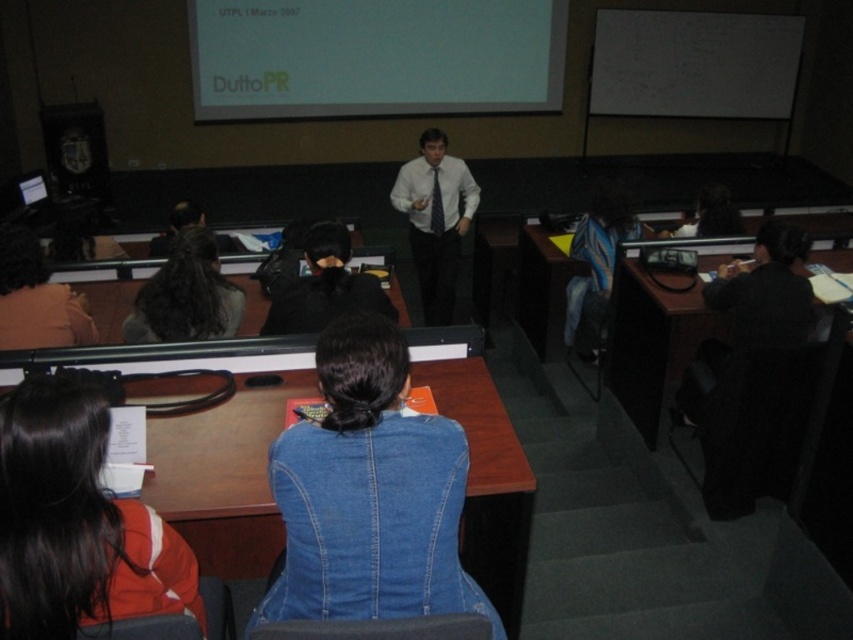
Does wooden desk at center appear over dark brown hair at lower left?

Actually, wooden desk at center is below dark brown hair at lower left.

Who is positioned more to the right, wooden desk at center or dark brown hair at lower left?

wooden desk at center

Based on the photo, who is more distant from viewer, (283, 387) or (51, 330)?

Positioned behind is point (51, 330).

Locate an element on the screen. wooden desk at center is located at coordinates (223, 476).

Between white matte projection screen at upper center and black plastic projector at center, which one appears on the left side from the viewer's perspective?

white matte projection screen at upper center is more to the left.

What do you see at coordinates (374, 58) in the screenshot? Image resolution: width=853 pixels, height=640 pixels. I see `white matte projection screen at upper center` at bounding box center [374, 58].

Locate an element on the screen. The image size is (853, 640). white matte projection screen at upper center is located at coordinates (374, 58).

Looking at this image, is denim jacket at center shorter than blue striped backpack at center?

Correct, denim jacket at center is not as tall as blue striped backpack at center.

Who is positioned more to the right, denim jacket at center or blue striped backpack at center?

blue striped backpack at center

Is point (369, 596) less distant than point (575, 237)?

That is True.

The height and width of the screenshot is (640, 853). In order to click on denim jacket at center in this screenshot , I will do `click(369, 492)`.